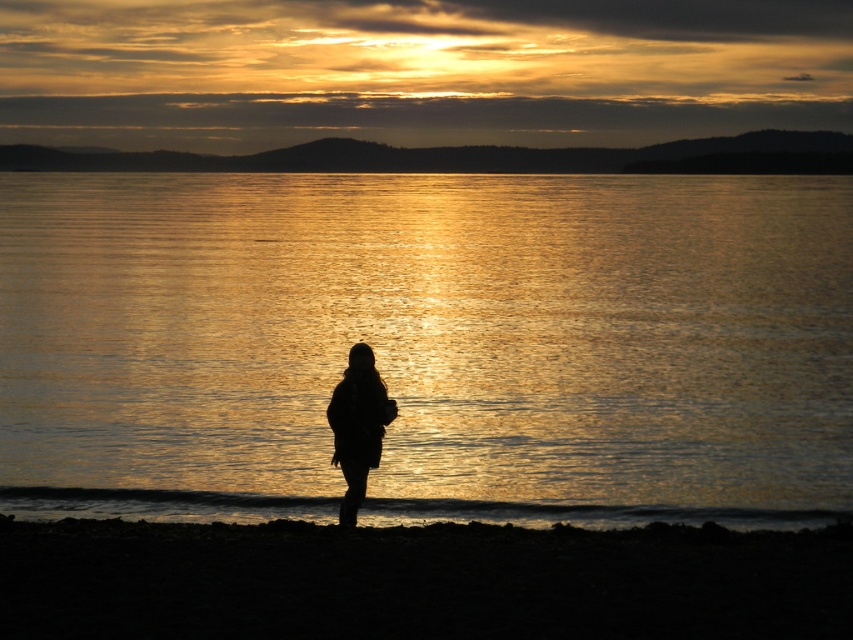
Question: Which object appears closest to the camera in this image?

Choices:
 (A) glistening reflective water at center
 (B) silhouette fabric at center
 (C) silvery reflective water at upper center

Answer: (B)

Question: Is silvery reflective water at upper center thinner than silhouette fabric at center?

Choices:
 (A) no
 (B) yes

Answer: (A)

Question: Which of these objects is positioned closest to the silvery reflective water at upper center?

Choices:
 (A) glistening reflective water at center
 (B) silhouette fabric at center

Answer: (A)

Question: Is glistening reflective water at center below silhouette fabric at center?

Choices:
 (A) no
 (B) yes

Answer: (A)

Question: Which object is positioned farthest from the silvery reflective water at upper center?

Choices:
 (A) silhouette fabric at center
 (B) glistening reflective water at center

Answer: (A)

Question: Can you confirm if glistening reflective water at center is smaller than silhouette fabric at center?

Choices:
 (A) no
 (B) yes

Answer: (A)